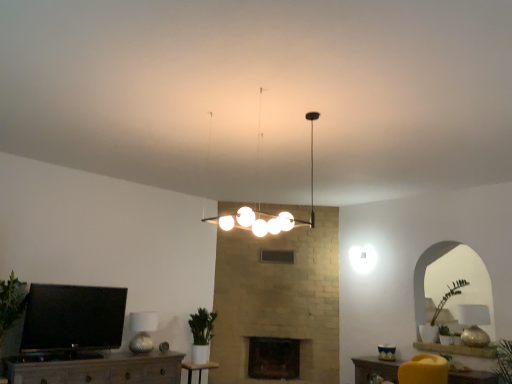
You are a GUI agent. You are given a task and a screenshot of the screen. Output one action in this format:
    pyautogui.click(x=<x>, y=<y>)
    Task: Click on the vacant space underneath metallic textured lampshade at lower left, acting as the 1th lamp starting from the left (from a real-world perspective)
    The width and height of the screenshot is (512, 384).
    Given the screenshot: What is the action you would take?
    click(140, 353)